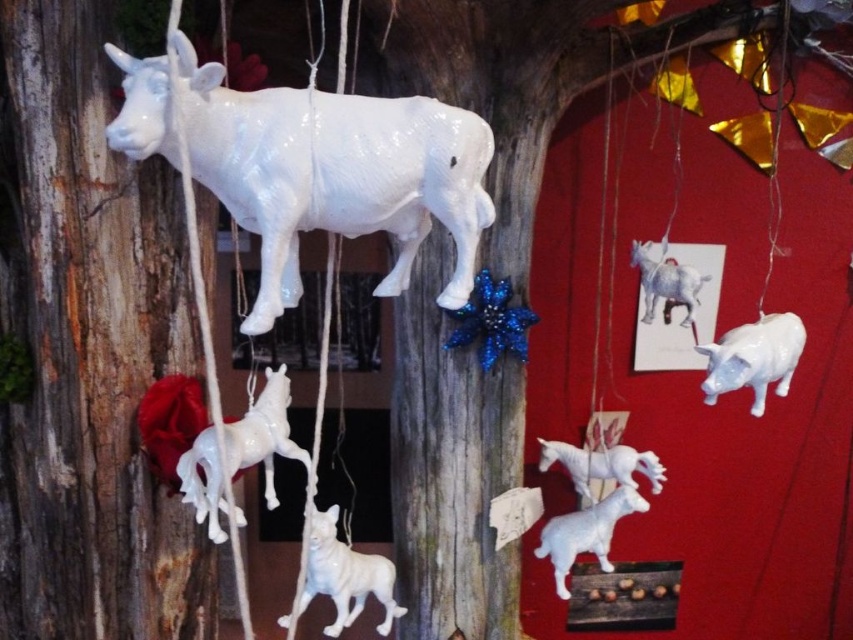
Does point (315, 572) lie behind point (573, 486)?

That is False.

What do you see at coordinates (345, 576) in the screenshot? This screenshot has height=640, width=853. I see `white glossy dog at center` at bounding box center [345, 576].

The image size is (853, 640). Find the location of `white glossy dog at center`. white glossy dog at center is located at coordinates (345, 576).

Describe the element at coordinates (335, 173) in the screenshot. The height and width of the screenshot is (640, 853). I see `white glossy cow at upper left` at that location.

Is white glossy cow at upper left further to camera compared to white glossy pig at right?

No, it is not.

Where is `white glossy cow at upper left`? The height and width of the screenshot is (640, 853). white glossy cow at upper left is located at coordinates (335, 173).

Can you confirm if smooth wood tree trunk at left is positioned to the right of white glossy goat at upper center?

No, smooth wood tree trunk at left is not to the right of white glossy goat at upper center.

Locate an element on the screen. The width and height of the screenshot is (853, 640). smooth wood tree trunk at left is located at coordinates (88, 353).